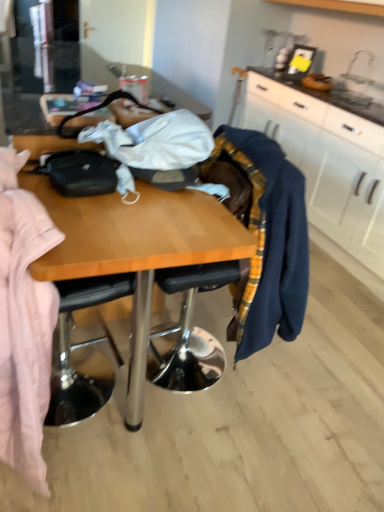
Question: Considering the relative sizes of white matte cabinet at upper right and metallic silver chair at center in the image provided, is white matte cabinet at upper right taller than metallic silver chair at center?

Choices:
 (A) no
 (B) yes

Answer: (A)

Question: Can you confirm if white matte cabinet at upper right is wider than metallic silver chair at center?

Choices:
 (A) no
 (B) yes

Answer: (A)

Question: Is white matte cabinet at upper right further to camera compared to metallic silver chair at center?

Choices:
 (A) yes
 (B) no

Answer: (A)

Question: Considering the relative sizes of white matte cabinet at upper right and metallic silver chair at center in the image provided, is white matte cabinet at upper right bigger than metallic silver chair at center?

Choices:
 (A) no
 (B) yes

Answer: (B)

Question: From a real-world perspective, is white matte cabinet at upper right positioned under metallic silver chair at center based on gravity?

Choices:
 (A) yes
 (B) no

Answer: (B)

Question: Is white matte cabinet at upper right thinner than metallic silver chair at center?

Choices:
 (A) yes
 (B) no

Answer: (A)

Question: Considering the relative sizes of navy blue sweater at right and metallic silver chair at center in the image provided, is navy blue sweater at right shorter than metallic silver chair at center?

Choices:
 (A) no
 (B) yes

Answer: (B)

Question: From the image's perspective, is navy blue sweater at right located beneath metallic silver chair at center?

Choices:
 (A) yes
 (B) no

Answer: (B)

Question: Is navy blue sweater at right positioned beyond the bounds of metallic silver chair at center?

Choices:
 (A) yes
 (B) no

Answer: (B)

Question: Is navy blue sweater at right bigger than metallic silver chair at center?

Choices:
 (A) yes
 (B) no

Answer: (B)

Question: Are navy blue sweater at right and metallic silver chair at center making contact?

Choices:
 (A) yes
 (B) no

Answer: (B)

Question: From a real-world perspective, is navy blue sweater at right below metallic silver chair at center?

Choices:
 (A) yes
 (B) no

Answer: (B)

Question: Is metallic silver chair at center bigger than navy blue sweater at right?

Choices:
 (A) yes
 (B) no

Answer: (A)